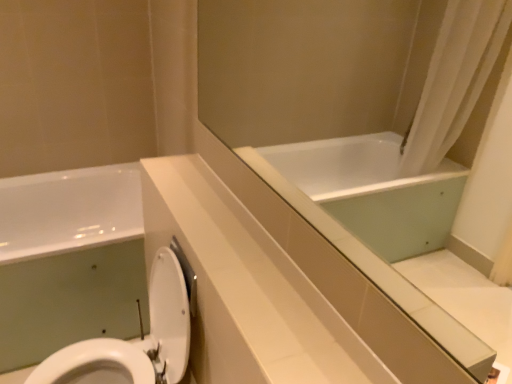
Question: Is white glossy counter top at center completely or partially inside white glossy toilet at lower left?

Choices:
 (A) yes
 (B) no

Answer: (B)

Question: Does white glossy toilet at lower left have a lesser width compared to white glossy counter top at center?

Choices:
 (A) no
 (B) yes

Answer: (A)

Question: Would you consider white glossy toilet at lower left to be distant from white glossy counter top at center?

Choices:
 (A) yes
 (B) no

Answer: (B)

Question: From the image's perspective, is white glossy toilet at lower left located above white glossy counter top at center?

Choices:
 (A) no
 (B) yes

Answer: (A)

Question: Does white glossy toilet at lower left have a greater width compared to white glossy counter top at center?

Choices:
 (A) yes
 (B) no

Answer: (A)

Question: Is white glossy bathtub at lower left taller or shorter than white glossy counter top at center?

Choices:
 (A) tall
 (B) short

Answer: (A)

Question: In the image, is white glossy bathtub at lower left positioned in front of or behind white glossy counter top at center?

Choices:
 (A) behind
 (B) front

Answer: (A)

Question: From a real-world perspective, relative to white glossy counter top at center, is white glossy bathtub at lower left vertically above or below?

Choices:
 (A) below
 (B) above

Answer: (A)

Question: Is point (139, 226) closer or farther from the camera than point (315, 352)?

Choices:
 (A) farther
 (B) closer

Answer: (A)

Question: Is white glossy counter top at center bigger or smaller than white glossy bathtub at lower left?

Choices:
 (A) small
 (B) big

Answer: (A)

Question: Is white glossy counter top at center inside the boundaries of white glossy bathtub at lower left, or outside?

Choices:
 (A) inside
 (B) outside

Answer: (B)

Question: Considering their positions, is white glossy counter top at center located in front of or behind white glossy bathtub at lower left?

Choices:
 (A) front
 (B) behind

Answer: (A)

Question: Considering the relative positions of white glossy counter top at center and white glossy bathtub at lower left in the image provided, is white glossy counter top at center to the left or to the right of white glossy bathtub at lower left?

Choices:
 (A) right
 (B) left

Answer: (A)

Question: Is point (176, 377) closer or farther from the camera than point (89, 187)?

Choices:
 (A) farther
 (B) closer

Answer: (B)

Question: From the image's perspective, is white glossy toilet at lower left positioned above or below white glossy bathtub at lower left?

Choices:
 (A) above
 (B) below

Answer: (B)